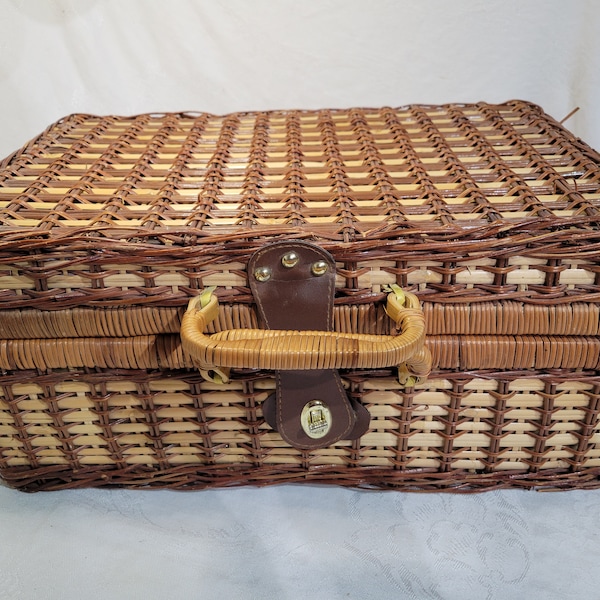
I want to click on handle, so click(316, 359).